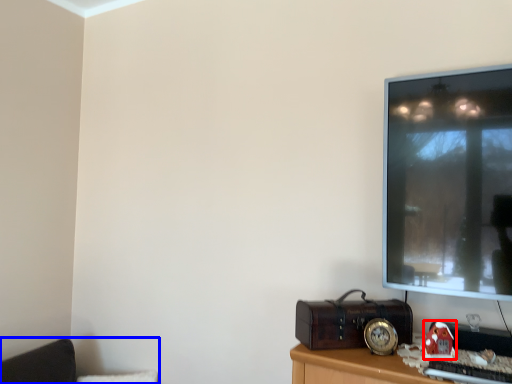
Question: Which object appears closest to the camera in this image, toy (highlighted by a red box) or furniture (highlighted by a blue box)?

Choices:
 (A) toy
 (B) furniture

Answer: (A)